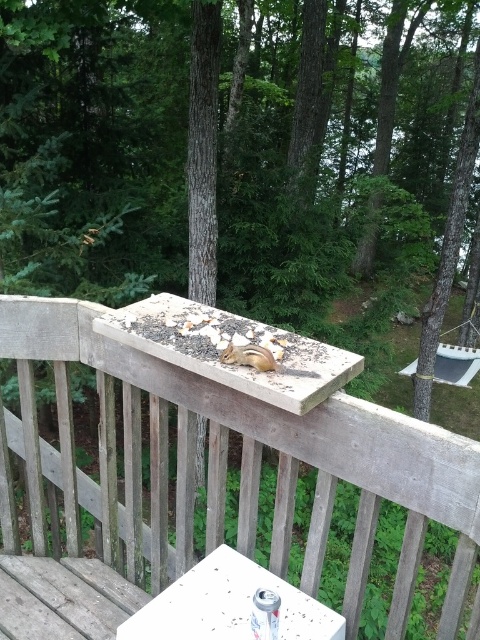
You are standing on the wooden deck and want to place a new bird feeder at the point that is exactly 6 feet away from you. Is the existing bird feeder at point (124,394) a good candidate for this location?

The distance of point (124,394) from viewer is 5.93 feet, so yes, the existing bird feeder at point (124,394) is a good candidate because it is very close to 6 feet away.

You are a photographer trying to capture both the white plastic table at lower center and the gray fur squirrel at center in a single shot. Given their sizes, which object will appear bigger in your photo?

The white plastic table at lower center will appear bigger in the photo because it is larger in size than the gray fur squirrel at center.

You are standing on a wooden deck and see the wooden rail at upper center and the gray fur squirrel at center. Which object is located to the left of the other?

The wooden rail at upper center is positioned on the left side of gray fur squirrel at center.